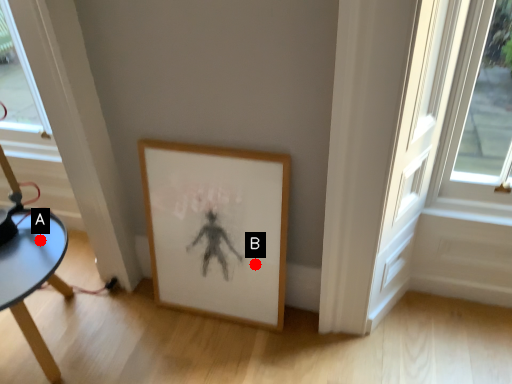
Question: Two points are circled on the image, labeled by A and B beside each circle. Which of the following is the closest to the observer?

Choices:
 (A) A is closer
 (B) B is closer

Answer: (A)